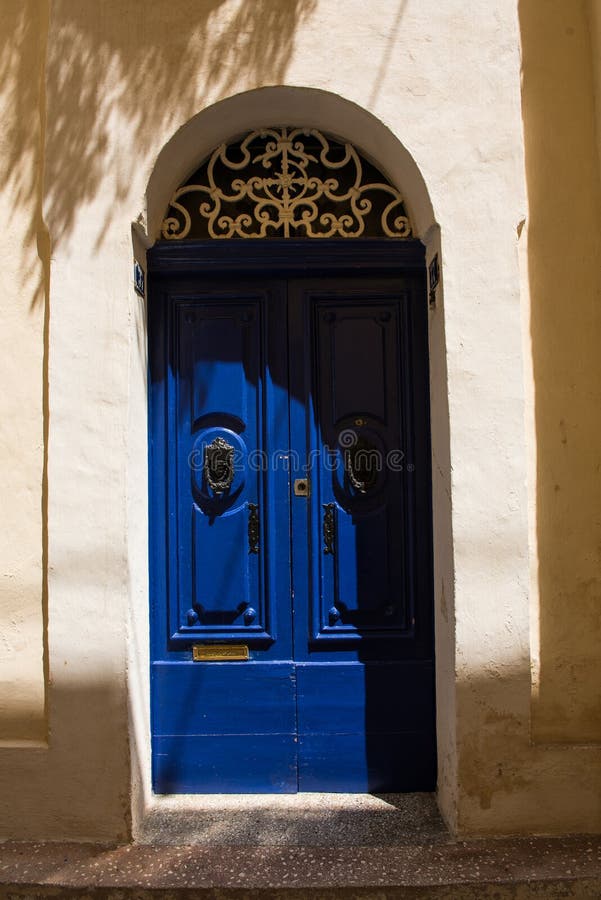
What are the coordinates of `letter hole` in the screenshot? It's located at (218, 652).